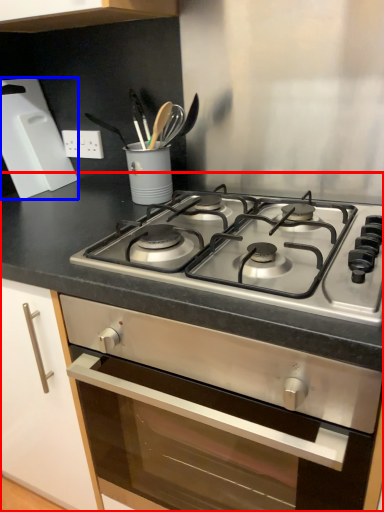
Question: Which object is further to the camera taking this photo, countertop (highlighted by a red box) or kitchen appliance (highlighted by a blue box)?

Choices:
 (A) countertop
 (B) kitchen appliance

Answer: (B)